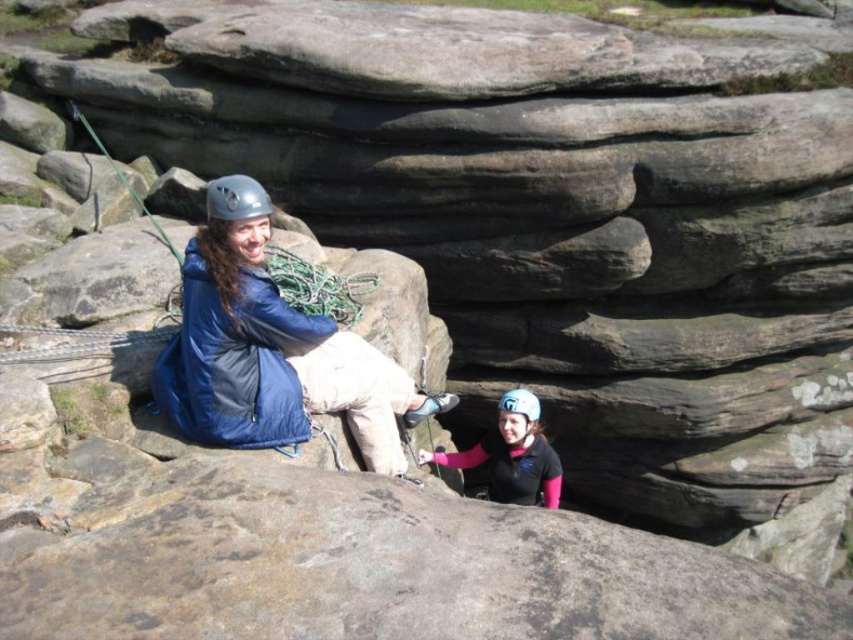
You are a photographer positioned at the base of the rock formation. You need to capture a photo that includes both the blue synthetic jacket at upper left and the matte white helmet at center. Which object should you pan your camera towards first to ensure both are in frame?

You should pan your camera towards the blue synthetic jacket at upper left first because it is positioned to the left of the matte white helmet at center, so starting there ensures both objects are captured in the frame.

You are a photographer positioned at the origin point of the image. Your task is to capture a photo of the blue synthetic jacket at upper left. Given that the coordinate system starts at the bottom left corner of the image with x increasing to the right and y increasing upwards, can you confirm if the jacket is located in the upper half of the image?

The blue synthetic jacket at upper left is positioned at point (x=271, y=349). Since the y coordinate is 0.319, which is below 0.5, it is not in the upper half of the image.

You are a drone operator trying to capture a photo of the blue synthetic jacket at upper left. The camera is currently centered at point 0.5, 0.5. Should you move the camera to the left or right to frame the jacket properly?

The blue synthetic jacket at upper left is located at point (271, 349). Since the camera is centered at (426, 320), the jacket is slightly to the right and below the current center. To frame it properly, move the camera slightly to the right and down.